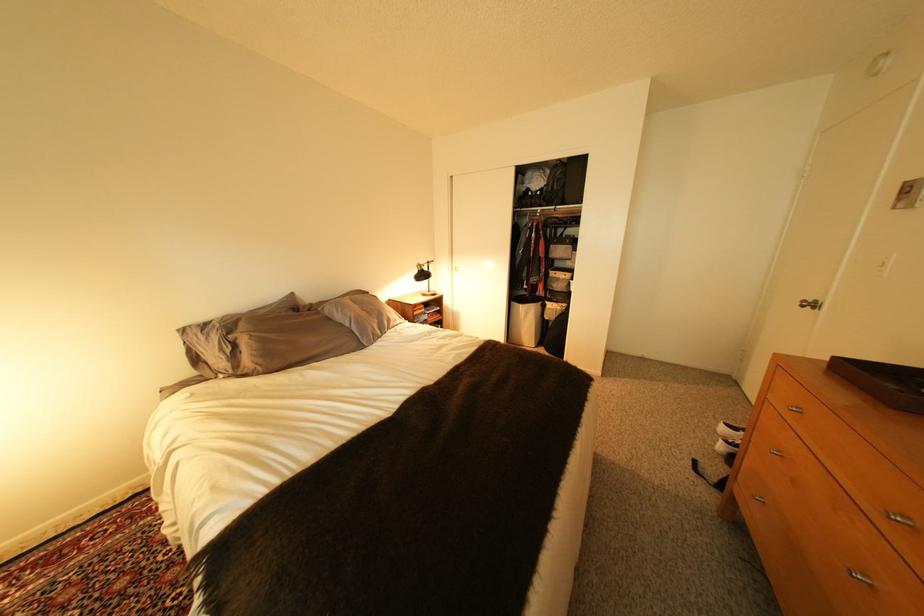
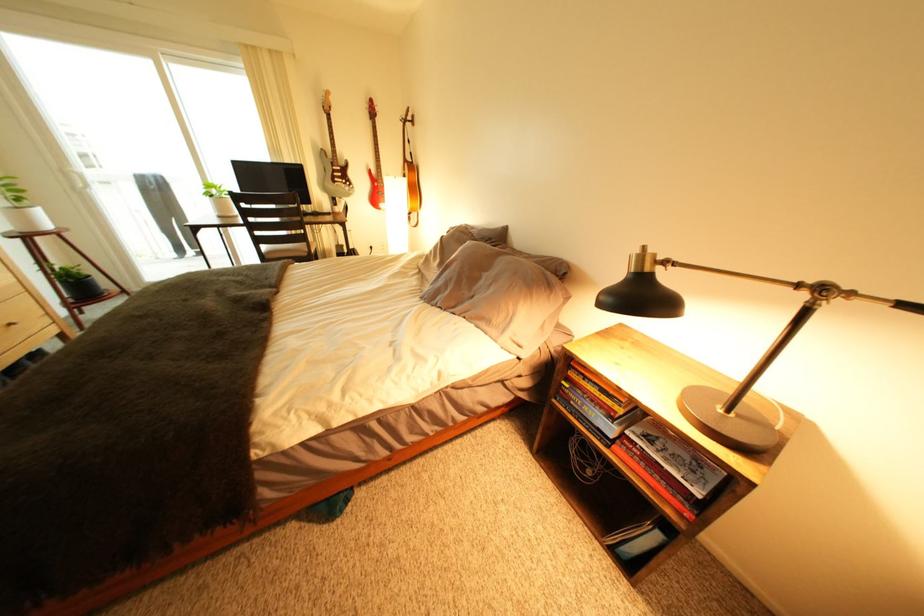
In the second image, find the point that corresponds to point (441, 264) in the first image.

(834, 291)